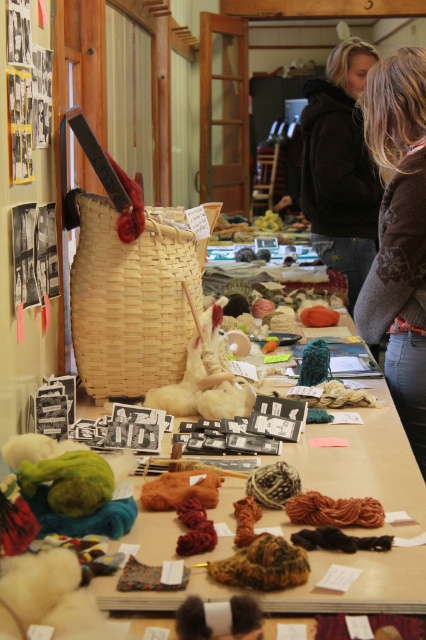
Does woven basket at center have a lesser height compared to woven straw basket at center?

Correct, woven basket at center is not as tall as woven straw basket at center.

Does point (403, 532) lie in front of point (135, 326)?

Yes, it is.

Identify the location of woven basket at center. (363, 465).

Is woven basket at center bigger than black fuzzy jacket at upper center?

Incorrect, woven basket at center is not larger than black fuzzy jacket at upper center.

What do you see at coordinates (363, 465) in the screenshot? I see `woven basket at center` at bounding box center [363, 465].

Where is `woven basket at center`? This screenshot has height=640, width=426. woven basket at center is located at coordinates (363, 465).

You are a GUI agent. You are given a task and a screenshot of the screen. Output one action in this format:
    pyautogui.click(x=<x>, y=<y>)
    Task: Click on the woven straw basket at center
    
    Given the screenshot: What is the action you would take?
    [x=131, y=300]

Is woven straw basket at center to the right of brown fuzzy sweater at upper right from the viewer's perspective?

In fact, woven straw basket at center is to the left of brown fuzzy sweater at upper right.

Between point (126, 365) and point (386, 276), which one is positioned in front?

Point (126, 365) is in front.

What are the coordinates of `woven straw basket at center` in the screenshot? It's located at (131, 300).